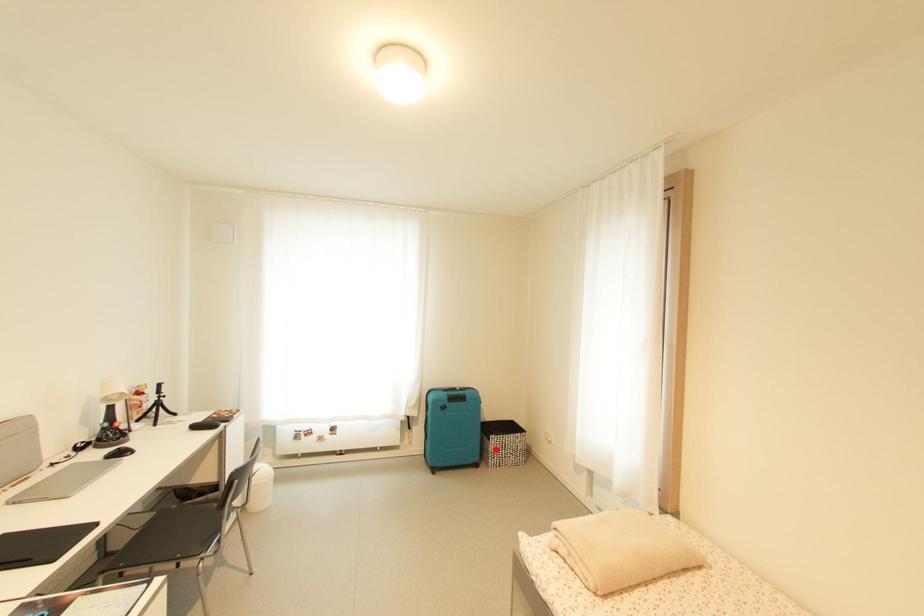
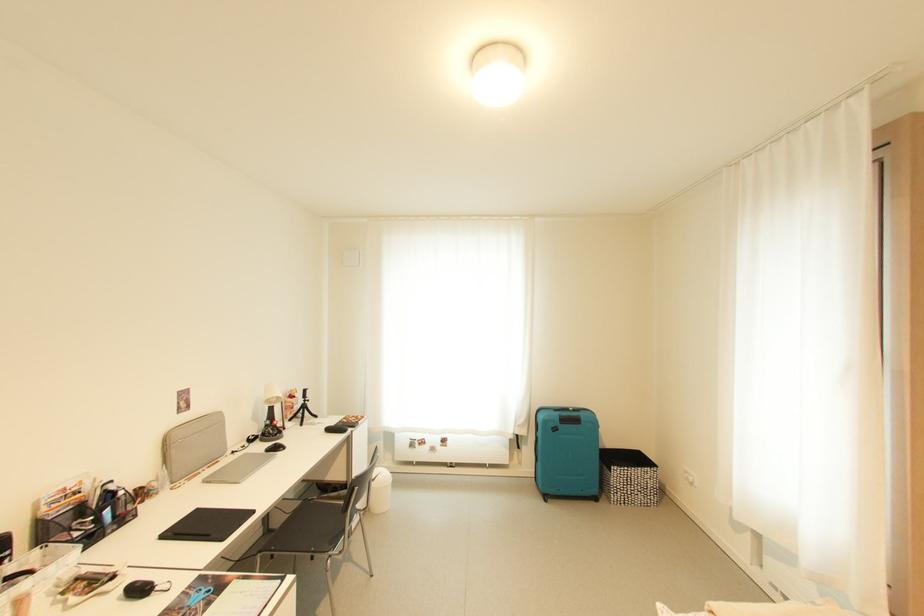
Question: I am providing you with two images of the same scene from different viewpoints. A red point is marked on the first image. Can you still see the location of the red point in image 2?

Choices:
 (A) Yes
 (B) No

Answer: (A)